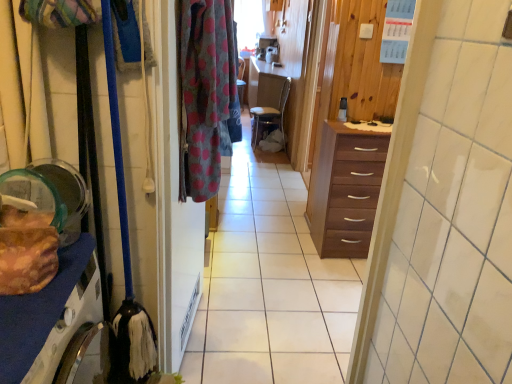
In order to click on free location in front of translucent plastic container at left in this screenshot , I will do `click(16, 324)`.